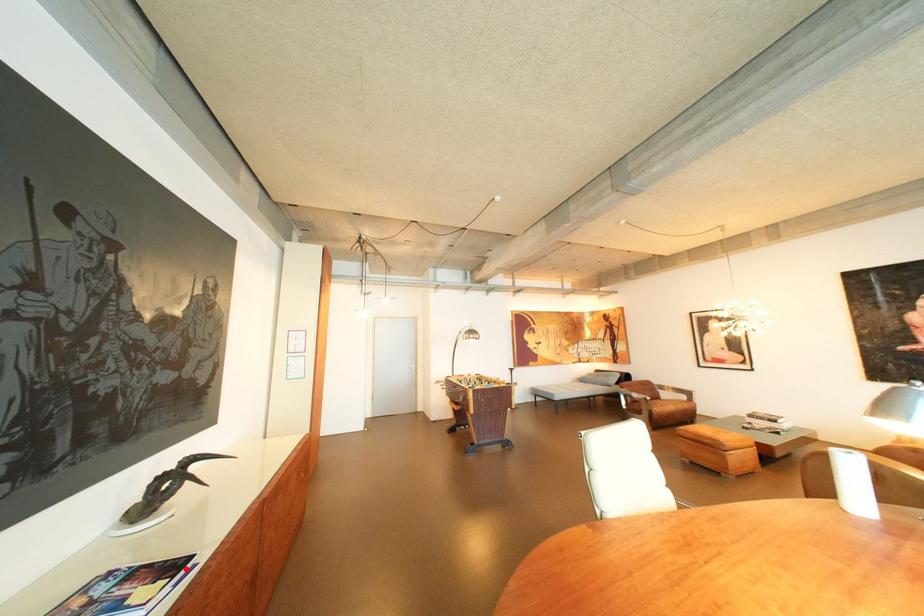
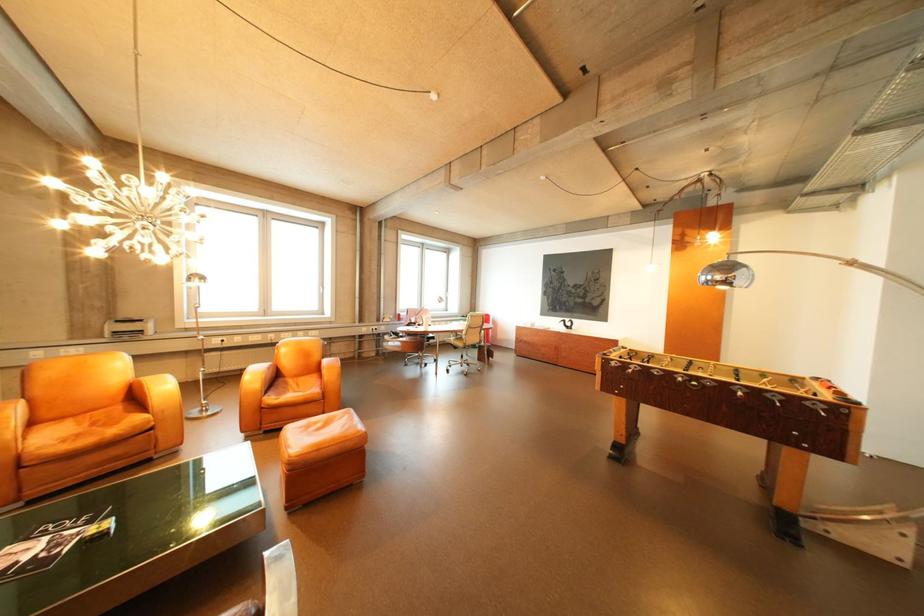
Question: I am providing you with two images of the same scene from different viewpoints. A red point is marked on the first image. At the location where the point appears in image 1, is it still visible in image 2?

Choices:
 (A) Yes
 (B) No

Answer: (B)